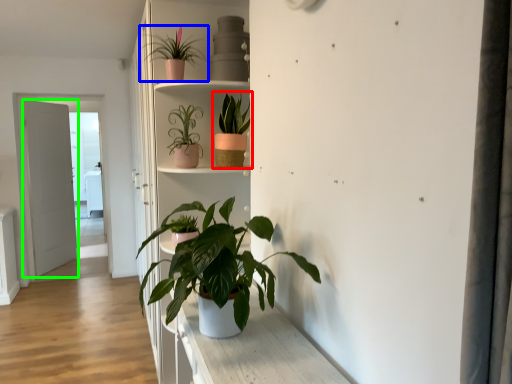
Question: Which object is the closest to the houseplant (highlighted by a red box)? Choose among these: houseplant (highlighted by a blue box) or door (highlighted by a green box).

Choices:
 (A) houseplant
 (B) door

Answer: (A)